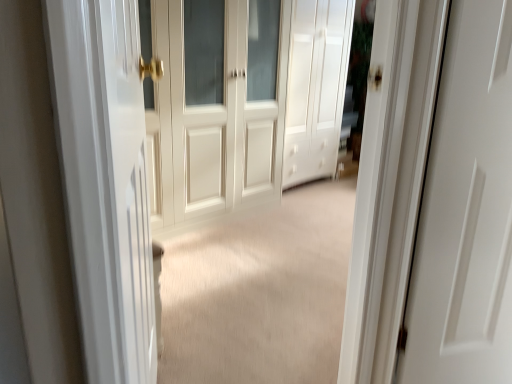
Question: Considering the relative sizes of white matte cabinet at center, acting as the second door starting from the left, and white glossy door at left in the image provided, is white matte cabinet at center, acting as the second door starting from the left, taller than white glossy door at left?

Choices:
 (A) no
 (B) yes

Answer: (B)

Question: Does white matte cabinet at center, which ranks as the 1th door in right-to-left order, appear on the left side of white glossy door at left?

Choices:
 (A) yes
 (B) no

Answer: (B)

Question: Would you say white glossy door at left is part of white matte cabinet at center, which ranks as the 1th door in right-to-left order,'s contents?

Choices:
 (A) yes
 (B) no

Answer: (B)

Question: Is the depth of white matte cabinet at center, which ranks as the 1th door in right-to-left order, less than that of white glossy door at left?

Choices:
 (A) no
 (B) yes

Answer: (A)

Question: Can you confirm if white matte cabinet at center, acting as the second door starting from the left, is thinner than white glossy door at left?

Choices:
 (A) no
 (B) yes

Answer: (A)

Question: Is white matte cabinet at center, which ranks as the 1th door in right-to-left order, in contact with white glossy door at left?

Choices:
 (A) no
 (B) yes

Answer: (A)

Question: Is white glossy door at left at the right side of white wood door at center, marked as the second door in a right-to-left arrangement?

Choices:
 (A) no
 (B) yes

Answer: (B)

Question: Is white glossy door at left oriented away from white wood door at center, the 1th door when ordered from left to right?

Choices:
 (A) no
 (B) yes

Answer: (A)

Question: From the image's perspective, is white glossy door at left on top of white wood door at center, marked as the second door in a right-to-left arrangement?

Choices:
 (A) no
 (B) yes

Answer: (A)

Question: From a real-world perspective, is white glossy door at left below white wood door at center, the 1th door when ordered from left to right?

Choices:
 (A) no
 (B) yes

Answer: (B)

Question: Can you confirm if white glossy door at left is smaller than white wood door at center, marked as the second door in a right-to-left arrangement?

Choices:
 (A) yes
 (B) no

Answer: (A)

Question: Is white glossy door at left behind white wood door at center, the 1th door when ordered from left to right?

Choices:
 (A) yes
 (B) no

Answer: (B)

Question: Does white wood door at center, marked as the second door in a right-to-left arrangement, appear on the right side of white glossy door at left?

Choices:
 (A) no
 (B) yes

Answer: (A)